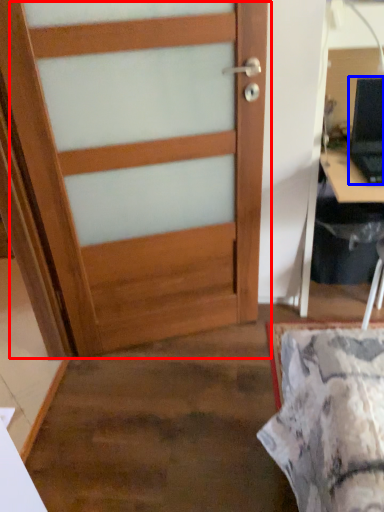
Question: Which point is closer to the camera, door (highlighted by a red box) or laptop (highlighted by a blue box)?

Choices:
 (A) door
 (B) laptop

Answer: (A)